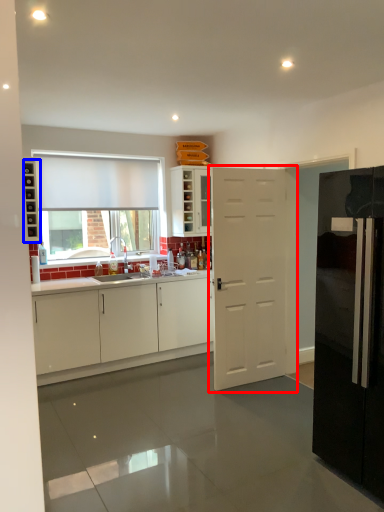
Question: Which of the following is the farthest to the observer, door (highlighted by a red box) or shelf (highlighted by a blue box)?

Choices:
 (A) door
 (B) shelf

Answer: (B)